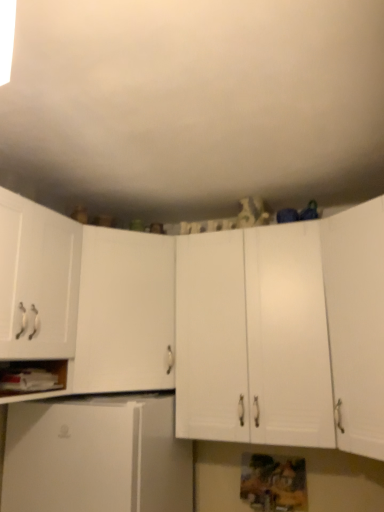
Question: Is white matte cabinet at right, which appears as the first cabinetry when viewed from the right, to the left or to the right of white matte refrigerator at lower left, which is counted as the fourth cabinetry, starting from the right, in the image?

Choices:
 (A) left
 (B) right

Answer: (B)

Question: Looking at the image, does white matte cabinet at right, which appears as the first cabinetry when viewed from the right, seem bigger or smaller compared to white matte refrigerator at lower left, which is counted as the fourth cabinetry, starting from the right?

Choices:
 (A) small
 (B) big

Answer: (A)

Question: Which of these objects is positioned farthest from the white matte cabinet at left, the third cabinetry from the left?

Choices:
 (A) white matte cabinet at left, which is counted as the fifth cabinetry, starting from the right
 (B) white matte cabinet at center, the fourth cabinetry viewed from the left
 (C) white matte cabinet at lower left
 (D) white matte refrigerator at lower left, which is counted as the fourth cabinetry, starting from the right
 (E) white matte cabinet at right, which appears as the first cabinetry when viewed from the right

Answer: (E)

Question: Estimate the real-world distances between objects in this image. Which object is farther from the white matte cabinet at lower left?

Choices:
 (A) white matte refrigerator at lower left, which is counted as the fourth cabinetry, starting from the right
 (B) white matte cabinet at left, placed as the first cabinetry when sorted from left to right
 (C) white matte cabinet at left, which ranks as the 3th cabinetry in right-to-left order
 (D) white matte cabinet at right, which appears as the first cabinetry when viewed from the right
 (E) white matte cabinet at center, the fourth cabinetry viewed from the left

Answer: (D)